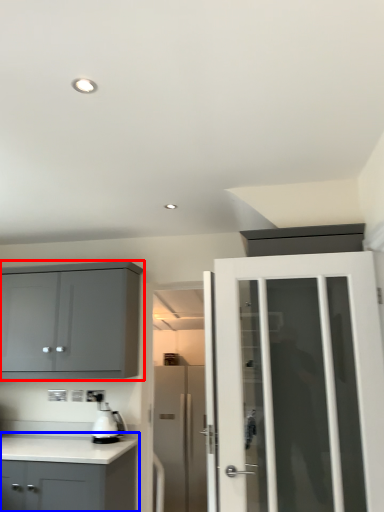
Question: Which object appears closest to the camera in this image, cabinetry (highlighted by a red box) or cabinetry (highlighted by a blue box)?

Choices:
 (A) cabinetry
 (B) cabinetry

Answer: (B)